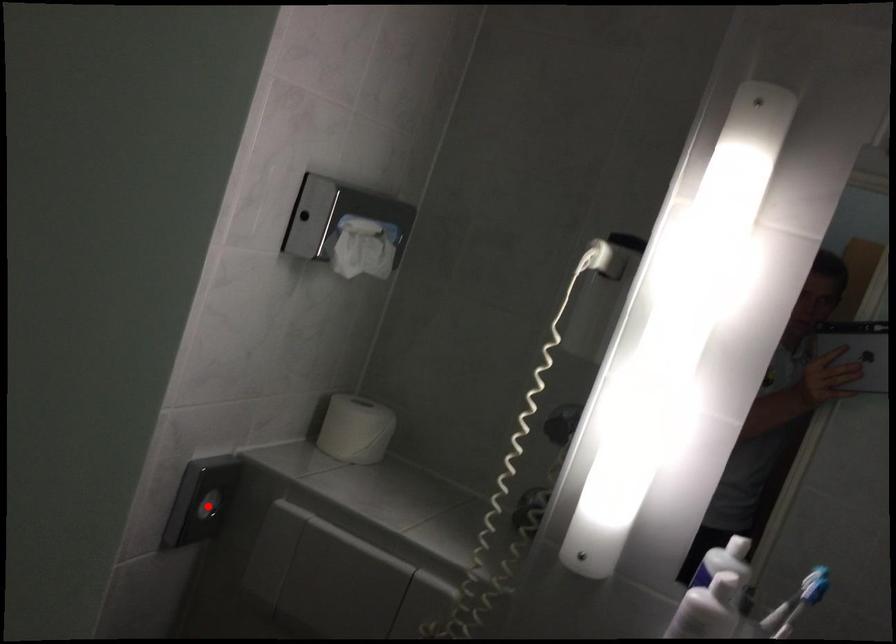
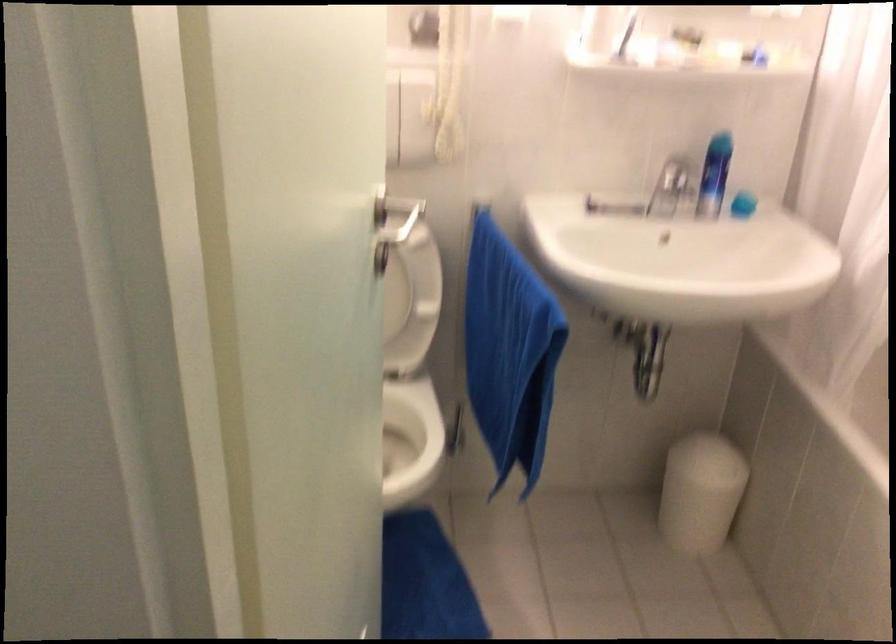
Question: I am providing you with two images of the same scene from different viewpoints. A red point is marked on the first image. At the location where the point appears in image 1, is it still visible in image 2?

Choices:
 (A) Yes
 (B) No

Answer: (B)